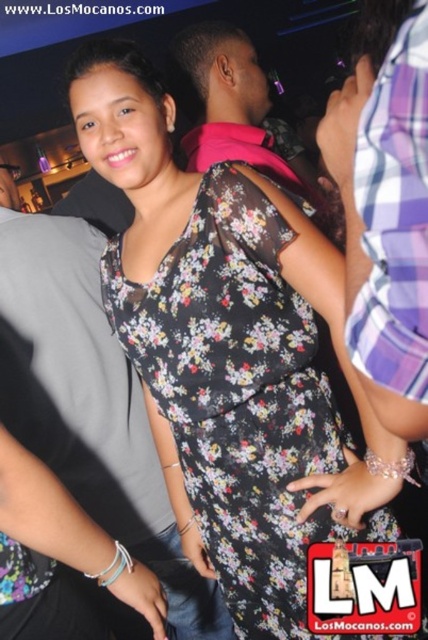
Is floral-patterned fabric dress at center further to camera compared to gray fabric shirt at upper left?

No, it is not.

Between floral-patterned fabric dress at center and gray fabric shirt at upper left, which one is positioned higher?

floral-patterned fabric dress at center is above.

Which is in front, point (146, 340) or point (127, 531)?

Positioned in front is point (146, 340).

The image size is (428, 640). I want to click on floral-patterned fabric dress at center, so click(240, 396).